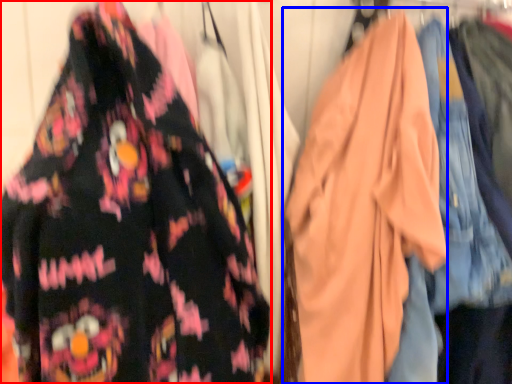
Question: Which of the following is the closest to the observer, fancy dress (highlighted by a red box) or garment (highlighted by a blue box)?

Choices:
 (A) fancy dress
 (B) garment

Answer: (A)